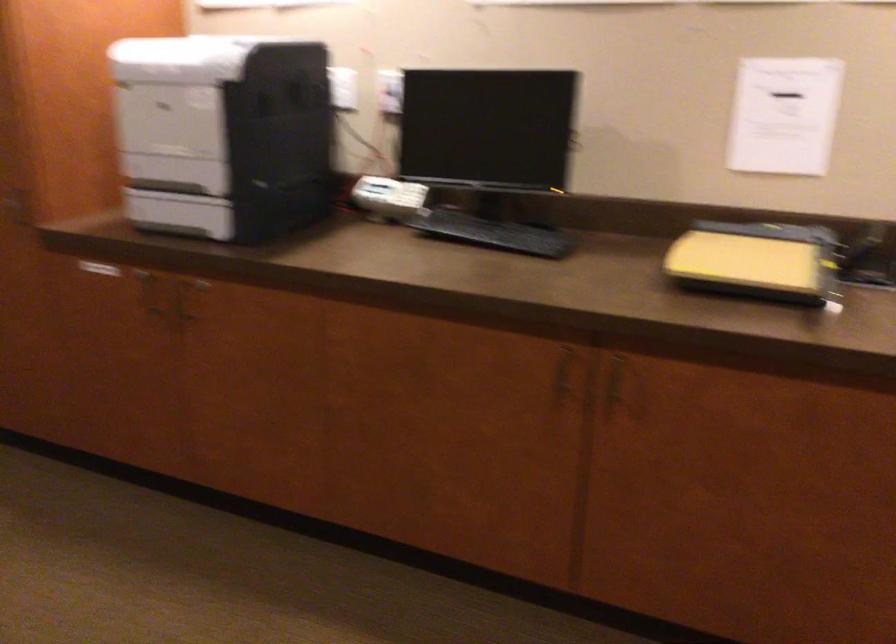
At what (x,y) coordinates should I click in order to perform the action: click on yellow trimmer lid. Please return your answer as a coordinate pair (x, y). The height and width of the screenshot is (644, 896). Looking at the image, I should click on (745, 261).